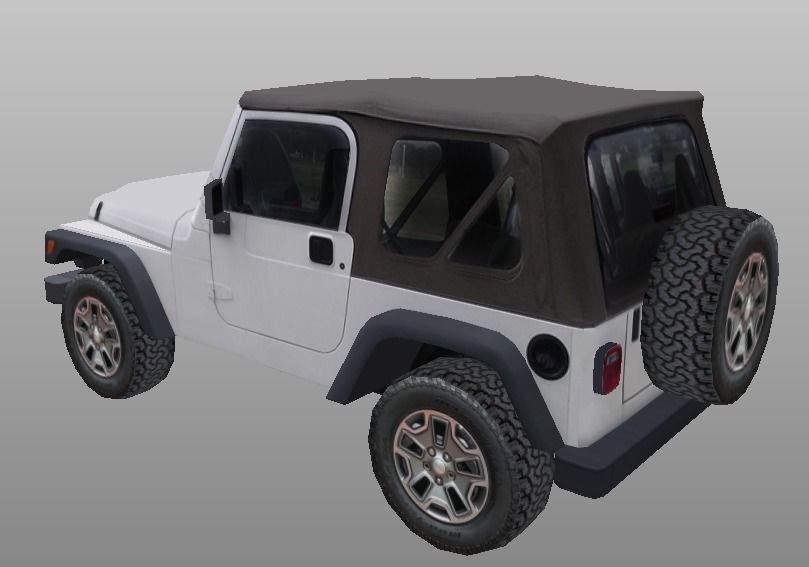
Where is `door handle`? door handle is located at coordinates (318, 247).